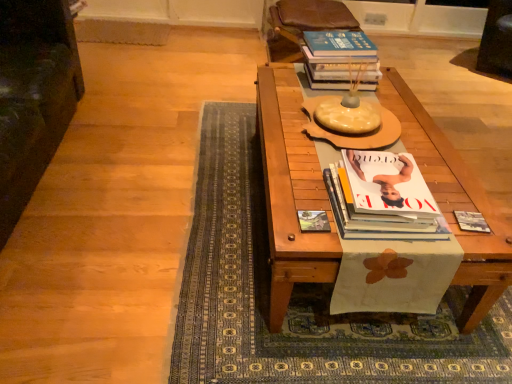
Find the location of a particular element. free point to the right of dark green fabric armchair at left, the second armchair when ordered from right to left is located at coordinates (153, 200).